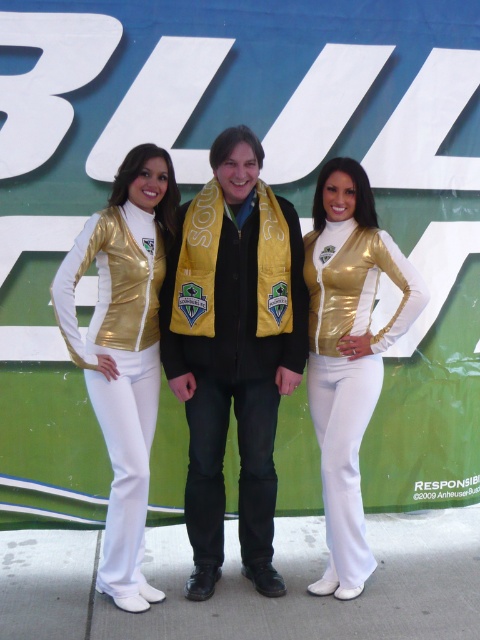
Which of these two, metallic gold vest at center or shiny gold jacket at center, stands taller?

With more height is metallic gold vest at center.

Is metallic gold vest at center bigger than shiny gold jacket at center?

Yes.

The height and width of the screenshot is (640, 480). I want to click on metallic gold vest at center, so click(x=123, y=349).

Is shiny yellow scarf at center behind metallic gold vest at center?

Yes, it is.

Does shiny yellow scarf at center have a greater width compared to metallic gold vest at center?

Correct, the width of shiny yellow scarf at center exceeds that of metallic gold vest at center.

Does point (200, 572) come behind point (111, 515)?

Yes, it is.

Where is `shiny yellow scarf at center`? shiny yellow scarf at center is located at coordinates (233, 349).

Between shiny yellow scarf at center and shiny gold jacket at center, which one is positioned lower?

shiny gold jacket at center

The image size is (480, 640). Find the location of `shiny yellow scarf at center`. shiny yellow scarf at center is located at coordinates (233, 349).